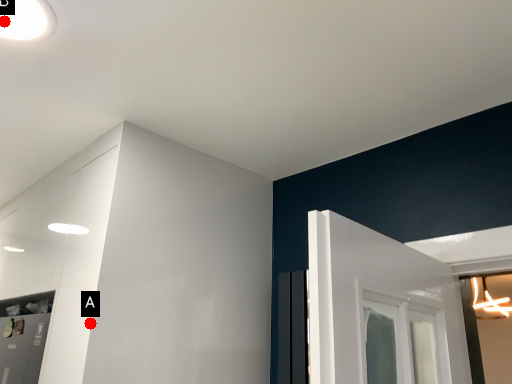
Question: Two points are circled on the image, labeled by A and B beside each circle. Which point appears closest to the camera in this image?

Choices:
 (A) A is closer
 (B) B is closer

Answer: (B)